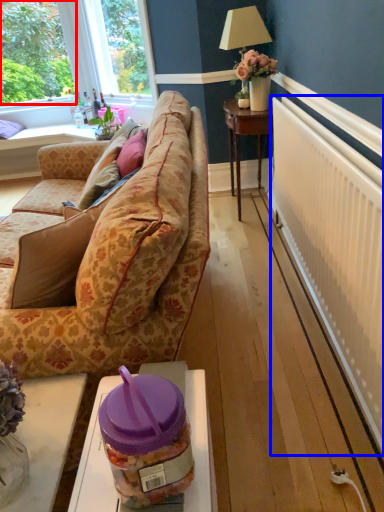
Question: Which object appears farthest to the camera in this image, plant (highlighted by a red box) or radiator (highlighted by a blue box)?

Choices:
 (A) plant
 (B) radiator

Answer: (A)